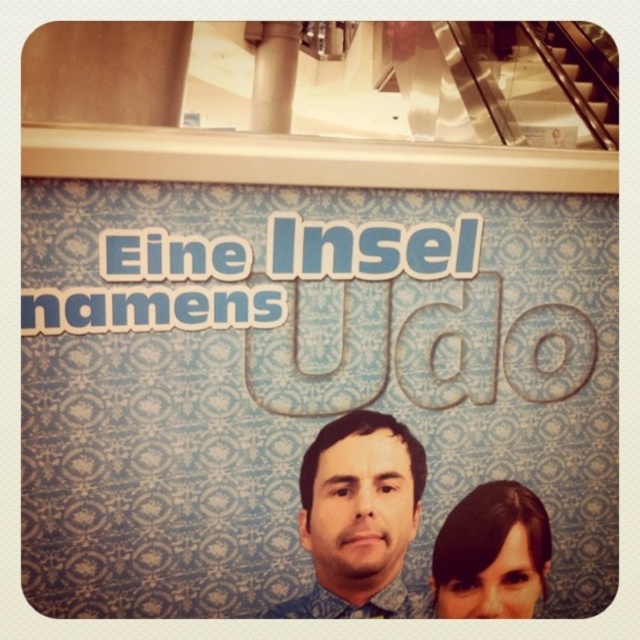
Looking at this image, you are standing in front of the wall with the text. You see two points marked on the wall. The first point is at coordinates point (342,577) and the second point is at point (449,529). If you want to touch the point that is closer to you, which coordinate should you aim for?

The point at coordinates point (342,577) is closer to the viewer, so you should aim for that coordinate.

You are standing in front of the wall with the text. You want to take a photo of both the blue patterned shirt at center and the metallic silver escalator at upper right in the same frame. Which object should you adjust your camera angle to include first?

The blue patterned shirt at center is located below the metallic silver escalator at upper right. To include both in the same frame, adjust your camera angle to first ensure the metallic silver escalator at upper right is visible, then frame the blue patterned shirt at center below it.

Based on the scene description, which object is shorter between the dark brown hair at upper center and the metallic silver escalator at upper right?

The dark brown hair at upper center is shorter than the metallic silver escalator at upper right.